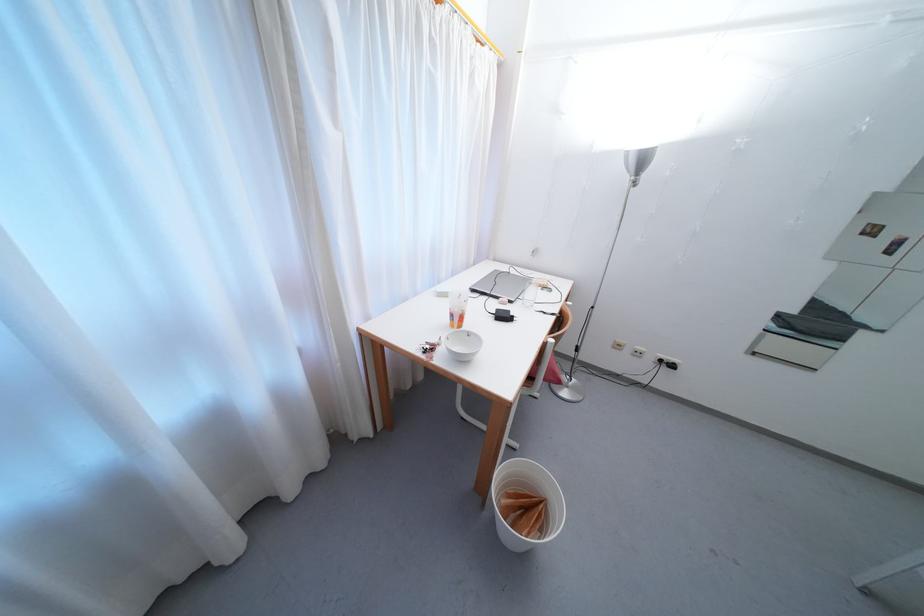
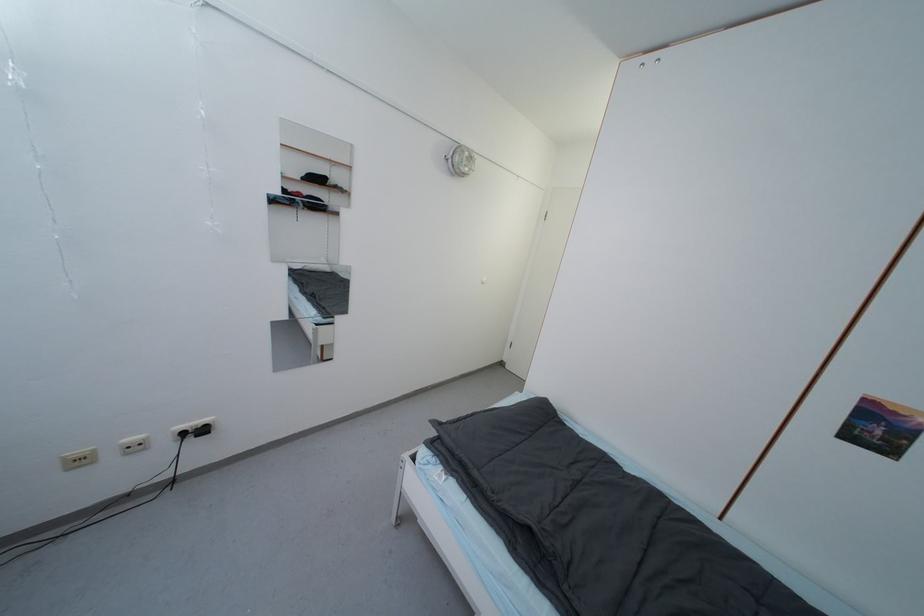
Question: The camera is either moving clockwise (left) or counter-clockwise (right) around the object. The first image is from the beginning of the video and the second image is from the end. Is the camera moving left or right when shooting the video?

Choices:
 (A) Left
 (B) Right

Answer: (A)